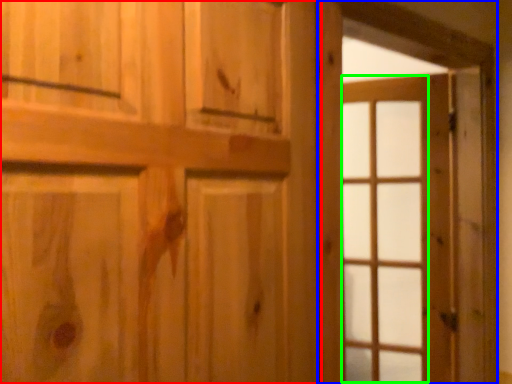
Question: Which object is the farthest from door (highlighted by a red box)? Choose among these: barn door (highlighted by a blue box) or glass door (highlighted by a green box).

Choices:
 (A) barn door
 (B) glass door

Answer: (B)